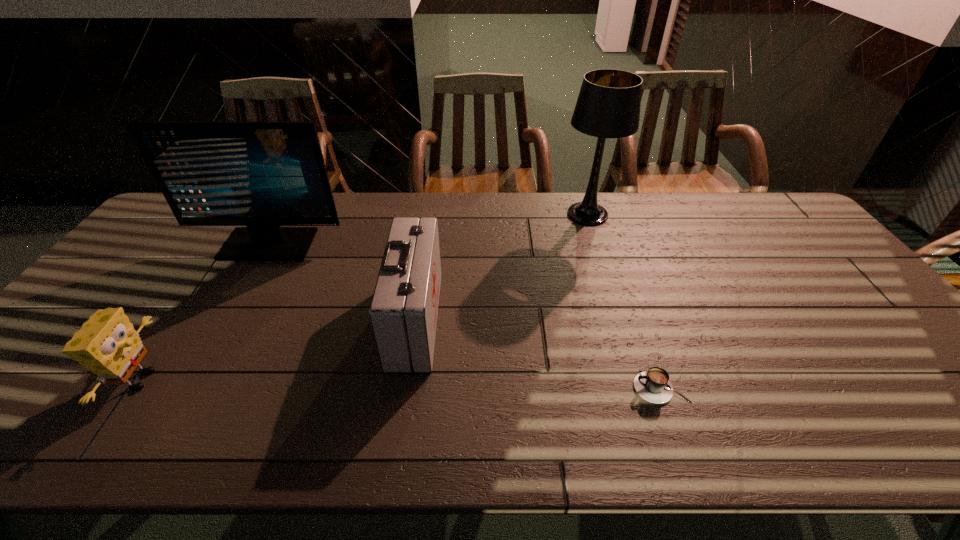
This screenshot has width=960, height=540. Find the location of `table lamp`. table lamp is located at coordinates (608, 106).

Where is `monitor`? The height and width of the screenshot is (540, 960). monitor is located at coordinates (260, 174).

Locate an element on the screen. The width and height of the screenshot is (960, 540). the third tallest object is located at coordinates (404, 308).

The image size is (960, 540). In order to click on the third object from right to left in this screenshot , I will do `click(404, 308)`.

Where is `sponge`? The image size is (960, 540). sponge is located at coordinates (107, 344).

This screenshot has width=960, height=540. I want to click on cappuccino, so click(653, 385).

Image resolution: width=960 pixels, height=540 pixels. In order to click on free region located on the right of the table lamp in this screenshot , I will do `click(663, 214)`.

Where is `vacant area located 0.110m on the screen side of the monitor`? The width and height of the screenshot is (960, 540). vacant area located 0.110m on the screen side of the monitor is located at coordinates (245, 286).

Where is `vacant area situated 0.310m on the front-facing side of the third shortest object`? Image resolution: width=960 pixels, height=540 pixels. vacant area situated 0.310m on the front-facing side of the third shortest object is located at coordinates (556, 320).

At what (x,y) coordinates should I click in order to perform the action: click on vacant area situated 0.290m on the face of the second shortest object. Please return your answer as a coordinate pair (x, y). The image size is (960, 540). Looking at the image, I should click on (286, 380).